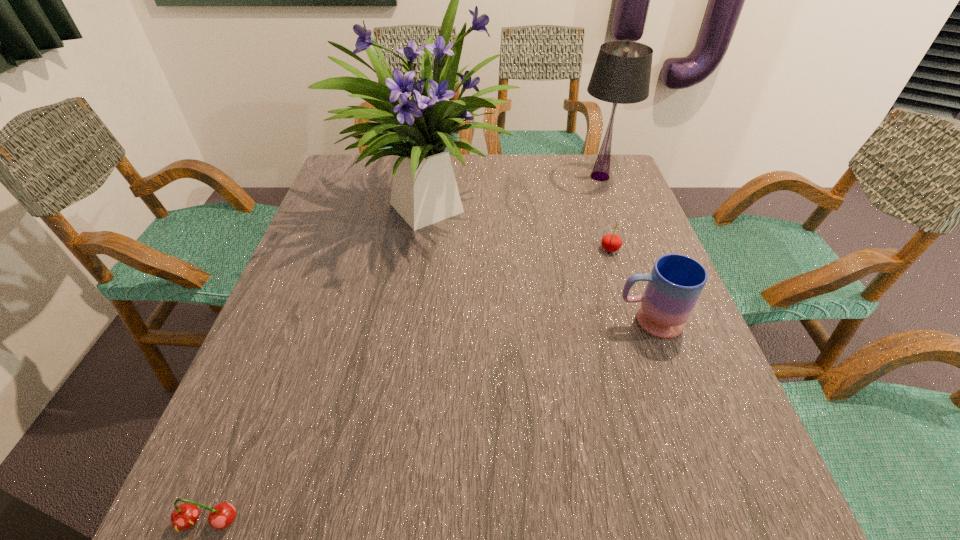
At what (x,y) coordinates should I click in order to perform the action: click on free spot between the third tallest object and the nearest object. Please return your answer as a coordinate pair (x, y). The image size is (960, 540). Looking at the image, I should click on (428, 421).

Identify the location of object identified as the second closest to the mug. (424, 191).

Point out which object is positioned as the second nearest to the farther cherry. Please provide its 2D coordinates. Your answer should be formatted as a tuple, i.e. [(x, y)], where the tuple contains the x and y coordinates of a point satisfying the conditions above.

[(424, 191)]

Where is `vacant space that satisfies the following two spatial constraints: 1. on the front-facing side of the second tallest object; 2. with stems pointing upwards on the nearest object`? vacant space that satisfies the following two spatial constraints: 1. on the front-facing side of the second tallest object; 2. with stems pointing upwards on the nearest object is located at coordinates (727, 522).

Identify the location of vacant space that satisfies the following two spatial constraints: 1. on the side of the third tallest object with the handle; 2. with stems pointing upwards on the nearest object. This screenshot has width=960, height=540. (720, 522).

Where is `vacant space that satisfies the following two spatial constraints: 1. on the side of the second nearest object with the handle; 2. with stems pointing upwards on the left cherry`? vacant space that satisfies the following two spatial constraints: 1. on the side of the second nearest object with the handle; 2. with stems pointing upwards on the left cherry is located at coordinates (720, 522).